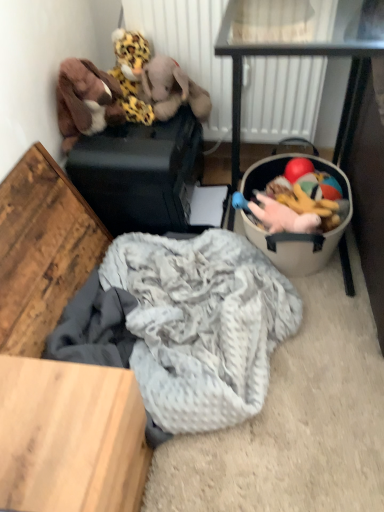
Question: Is fluffy leopard print plush at upper left, the first toy when ordered from top to bottom, behind metallic black table at right?

Choices:
 (A) yes
 (B) no

Answer: (A)

Question: From a real-world perspective, is fluffy leopard print plush at upper left, the first toy when ordered from top to bottom, below metallic black table at right?

Choices:
 (A) yes
 (B) no

Answer: (B)

Question: From the image's perspective, is fluffy leopard print plush at upper left, the first toy when ordered from top to bottom, above metallic black table at right?

Choices:
 (A) yes
 (B) no

Answer: (A)

Question: Is fluffy leopard print plush at upper left, placed as the second toy when sorted from bottom to top, placed right next to metallic black table at right?

Choices:
 (A) no
 (B) yes

Answer: (A)

Question: Considering the relative sizes of fluffy leopard print plush at upper left, the first toy when ordered from top to bottom, and metallic black table at right in the image provided, is fluffy leopard print plush at upper left, the first toy when ordered from top to bottom, bigger than metallic black table at right?

Choices:
 (A) yes
 (B) no

Answer: (B)

Question: From a real-world perspective, is wooden table at lower left positioned above or below brown plush toy at upper left, acting as the 1th toy starting from the bottom?

Choices:
 (A) above
 (B) below

Answer: (B)

Question: Considering the positions of wooden table at lower left and brown plush toy at upper left, acting as the 1th toy starting from the bottom, in the image, is wooden table at lower left taller or shorter than brown plush toy at upper left, acting as the 1th toy starting from the bottom,?

Choices:
 (A) short
 (B) tall

Answer: (B)

Question: Visually, is wooden table at lower left positioned to the left or to the right of brown plush toy at upper left, marked as the 2th toy in a top-to-bottom arrangement?

Choices:
 (A) left
 (B) right

Answer: (A)

Question: Relative to brown plush toy at upper left, marked as the 2th toy in a top-to-bottom arrangement, is wooden table at lower left in front or behind?

Choices:
 (A) behind
 (B) front

Answer: (B)

Question: Considering the positions of brown plush elephant at upper left and white textured radiator at upper center in the image, is brown plush elephant at upper left taller or shorter than white textured radiator at upper center?

Choices:
 (A) tall
 (B) short

Answer: (B)

Question: Is brown plush elephant at upper left inside or outside of white textured radiator at upper center?

Choices:
 (A) inside
 (B) outside

Answer: (B)

Question: Is brown plush elephant at upper left to the left or to the right of white textured radiator at upper center in the image?

Choices:
 (A) right
 (B) left

Answer: (B)

Question: Looking at the image, does brown plush elephant at upper left seem bigger or smaller compared to white textured radiator at upper center?

Choices:
 (A) big
 (B) small

Answer: (B)

Question: Considering the positions of metallic black table at right and soft gray knit blanket at lower center in the image, is metallic black table at right wider or thinner than soft gray knit blanket at lower center?

Choices:
 (A) thin
 (B) wide

Answer: (B)

Question: Would you say metallic black table at right is inside or outside soft gray knit blanket at lower center?

Choices:
 (A) inside
 (B) outside

Answer: (B)